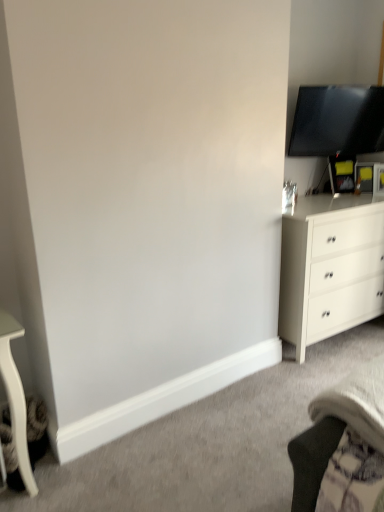
Where is `white matte chest of drawers at right`? white matte chest of drawers at right is located at coordinates (330, 267).

What do you see at coordinates (330, 267) in the screenshot?
I see `white matte chest of drawers at right` at bounding box center [330, 267].

Find the location of a particular element. matte black tv at upper right is located at coordinates (337, 121).

Measure the distance between matte black tv at upper right and camera.

They are 2.70 meters apart.

In order to face matte black tv at upper right, should I rotate leftwards or rightwards?

To face it directly, rotate right by 20.086 degrees.

The image size is (384, 512). What do you see at coordinates (337, 121) in the screenshot? I see `matte black tv at upper right` at bounding box center [337, 121].

Where is `white matte chest of drawers at right`? The width and height of the screenshot is (384, 512). white matte chest of drawers at right is located at coordinates (330, 267).

Consider the image. Between matte black tv at upper right and white matte chest of drawers at right, which one appears on the right side from the viewer's perspective?

matte black tv at upper right is more to the right.

Which object is closer to the camera, matte black tv at upper right or white matte chest of drawers at right?

white matte chest of drawers at right is more forward.

Consider the image. Which is further, (373, 115) or (328, 243)?

Positioned behind is point (373, 115).

From the image's perspective, which is below, matte black tv at upper right or white matte chest of drawers at right?

white matte chest of drawers at right, from the image's perspective.

From a real-world perspective, who is located lower, matte black tv at upper right or white matte chest of drawers at right?

white matte chest of drawers at right is physically lower.

Considering the relative sizes of matte black tv at upper right and white matte chest of drawers at right in the image provided, is matte black tv at upper right wider than white matte chest of drawers at right?

No.

Considering the sizes of objects matte black tv at upper right and white matte chest of drawers at right in the image provided, who is shorter, matte black tv at upper right or white matte chest of drawers at right?

matte black tv at upper right.

Consider the image. Considering the relative sizes of matte black tv at upper right and white matte chest of drawers at right in the image provided, is matte black tv at upper right bigger than white matte chest of drawers at right?

No, matte black tv at upper right is not bigger than white matte chest of drawers at right.

In the scene shown: Can white matte chest of drawers at right be found inside matte black tv at upper right?

No, white matte chest of drawers at right is located outside of matte black tv at upper right.

Is matte black tv at upper right not close to white matte chest of drawers at right?

No, matte black tv at upper right is not far from white matte chest of drawers at right.

Is matte black tv at upper right facing towards white matte chest of drawers at right?

No, matte black tv at upper right is not facing towards white matte chest of drawers at right.

How many degrees apart are the facing directions of matte black tv at upper right and white matte chest of drawers at right?

15.1 degrees.

How far apart are matte black tv at upper right and white matte chest of drawers at right?

They are 29.87 inches apart.

Image resolution: width=384 pixels, height=512 pixels. In the image, there is a matte black tv at upper right. Find the location of `the chest of drawers below it (from a real-world perspective)`. the chest of drawers below it (from a real-world perspective) is located at coordinates (330, 267).

Is white matte chest of drawers at right to the right of matte black tv at upper right from the viewer's perspective?

Incorrect, white matte chest of drawers at right is not on the right side of matte black tv at upper right.

Is white matte chest of drawers at right further to the viewer compared to matte black tv at upper right?

No.

Is point (328, 285) closer or farther from the camera than point (335, 142)?

Point (328, 285) is positioned closer to the camera compared to point (335, 142).

From the image's perspective, between white matte chest of drawers at right and matte black tv at upper right, who is located below?

white matte chest of drawers at right, from the image's perspective.

From a real-world perspective, is white matte chest of drawers at right positioned under matte black tv at upper right based on gravity?

Yes, from a real-world perspective, white matte chest of drawers at right is beneath matte black tv at upper right.

Can you confirm if white matte chest of drawers at right is wider than matte black tv at upper right?

Correct, the width of white matte chest of drawers at right exceeds that of matte black tv at upper right.

Does white matte chest of drawers at right have a greater height compared to matte black tv at upper right?

Yes, white matte chest of drawers at right is taller than matte black tv at upper right.

Between white matte chest of drawers at right and matte black tv at upper right, which one has smaller size?

matte black tv at upper right is smaller.

Is matte black tv at upper right completely or partially inside white matte chest of drawers at right?

No, matte black tv at upper right is located outside of white matte chest of drawers at right.

Are white matte chest of drawers at right and matte black tv at upper right located far from each other?

No, there isn't a large distance between white matte chest of drawers at right and matte black tv at upper right.

Is white matte chest of drawers at right turned away from matte black tv at upper right?

No, white matte chest of drawers at right is not facing the opposite direction of matte black tv at upper right.

At what (x,y) coordinates should I click in order to perform the action: click on television positioned vertically above the white matte chest of drawers at right (from a real-world perspective). Please return your answer as a coordinate pair (x, y). Image resolution: width=384 pixels, height=512 pixels. Looking at the image, I should click on (337, 121).

This screenshot has height=512, width=384. Find the location of `television lying behind the white matte chest of drawers at right`. television lying behind the white matte chest of drawers at right is located at coordinates (337, 121).

The height and width of the screenshot is (512, 384). Identify the location of chest of drawers on the left of matte black tv at upper right. (330, 267).